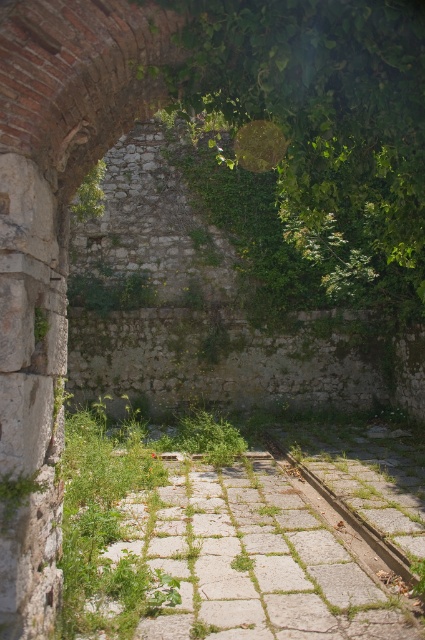
You are standing at point A and want to move to point B. You see two points marked in the image, point A at coordinates point A is point (314, 522) and point B at coordinates point B is point (356, 528). Which point is closer to your current position if you are at point A?

Point A is your current position, so it is closer to you than point B.

You are standing at the entrance of the ancient stone structure and see the gray stone path at center and the gray concrete train track at center. Which one is higher from the ground?

The gray stone path at center is much taller than the gray concrete train track at center, so the gray stone path at center is higher from the ground.